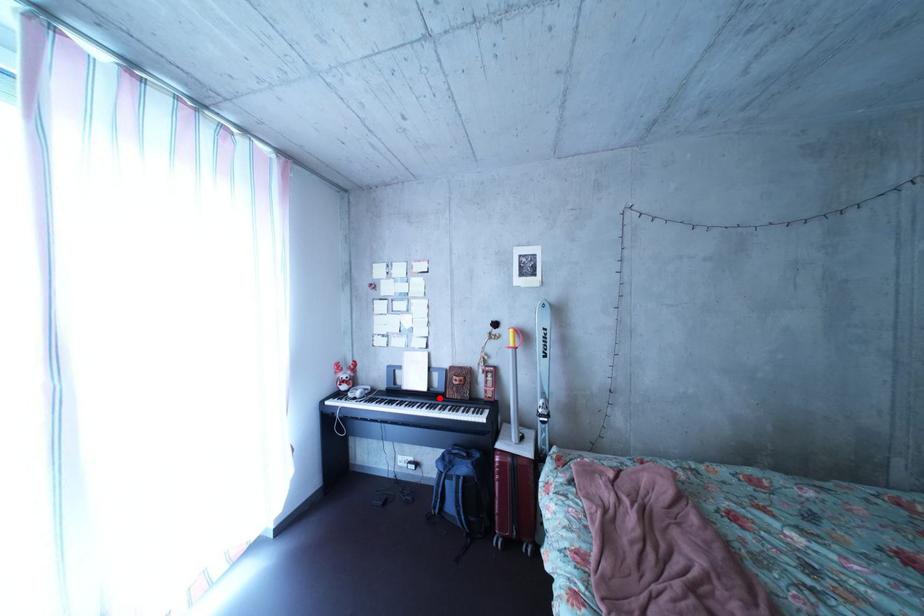
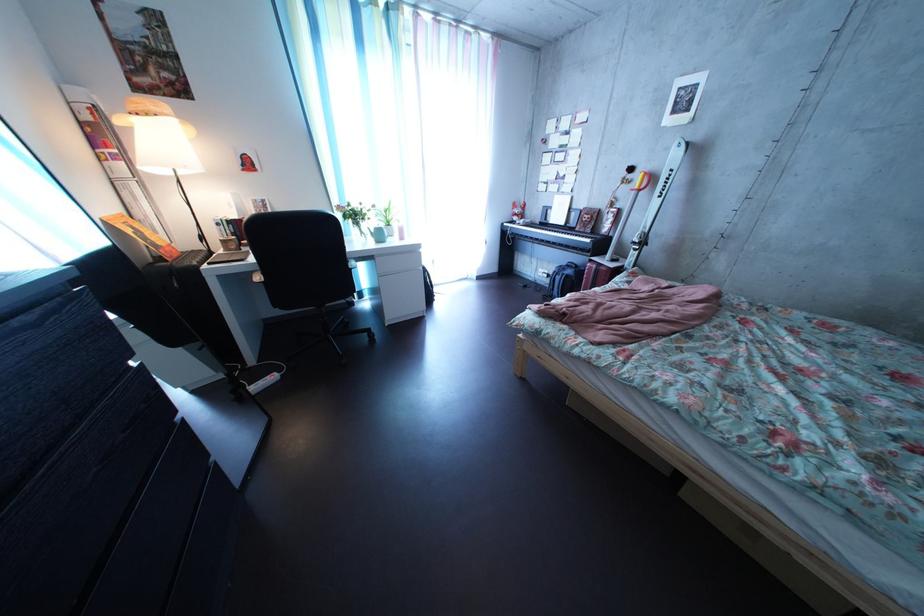
Question: I am providing you with two images of the same scene from different viewpoints. A red point is shown in image1. For the corresponding object point in image2, is it positioned nearer or farther from the camera?

Choices:
 (A) Nearer
 (B) Farther

Answer: (A)